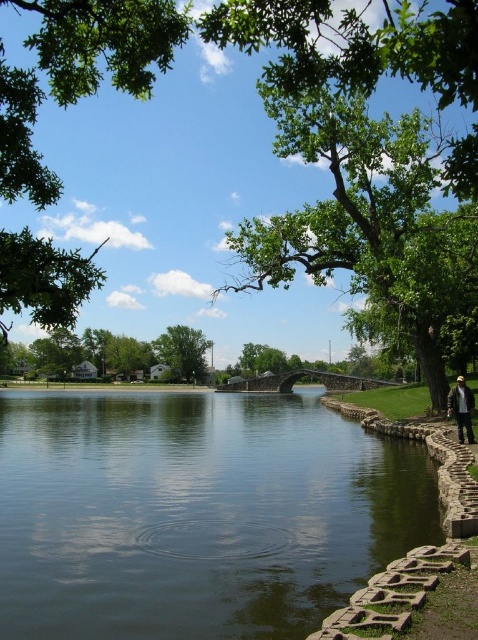
You are a photographer planning to capture the smooth concrete river at center and the green leafy tree at upper left in a single frame. Based on their sizes in the image, which object would appear more prominent in the photo?

The green leafy tree at upper left would appear more prominent in the photo since it is larger than the smooth concrete river at center.

You are standing at the edge of the smooth concrete river at center and want to walk towards the green leafy tree at upper left. Which direction should you face to walk directly towards it?

You should face towards the upper left direction because the green leafy tree at upper left is located in that direction relative to the smooth concrete river at center.